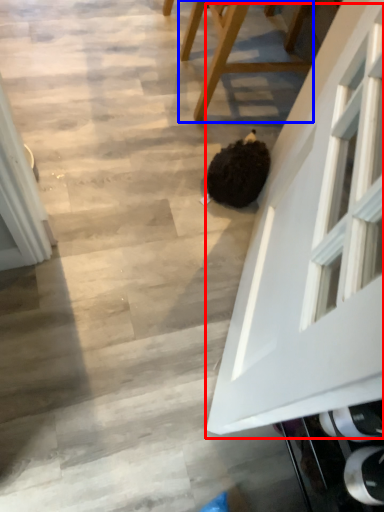
Question: Among these objects, which one is farthest to the camera, glass door (highlighted by a red box) or furniture (highlighted by a blue box)?

Choices:
 (A) glass door
 (B) furniture

Answer: (B)